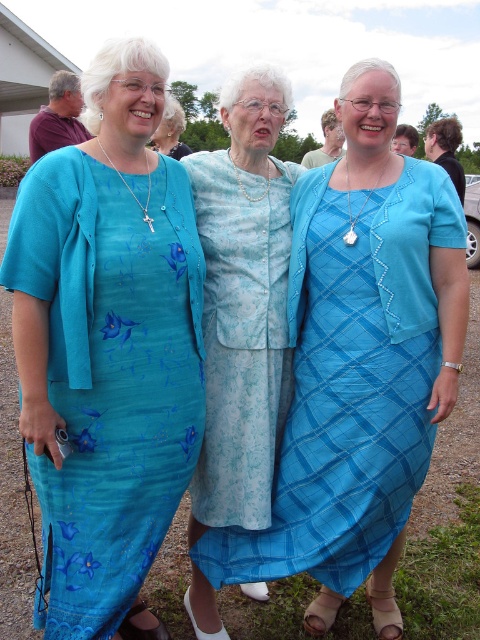
You are standing in front of the three women and want to take a photo of them. You notice two specific points marked in the image. The first point is at coordinates point (x=394, y=227) and the second point is at point (x=259, y=381). Which point is closer to you?

Point (x=394, y=227) is closer to the camera than point (x=259, y=381).

Based on the scene description, which dress is closer to the ground, the teal floral dress at center or the matte blue dress at center?

The teal floral dress at center is closer to the ground because it is positioned under the matte blue dress at center.

You are a photographer trying to capture a clear shot of both the teal floral dress at center and the light blue floral dress at center. Which dress should you focus on first to ensure it appears sharp in the photo?

You should focus on the teal floral dress at center first because it is closer to the viewer than the light blue floral dress at center, so focusing on it will ensure it appears sharp while the background dress may be slightly blurred.